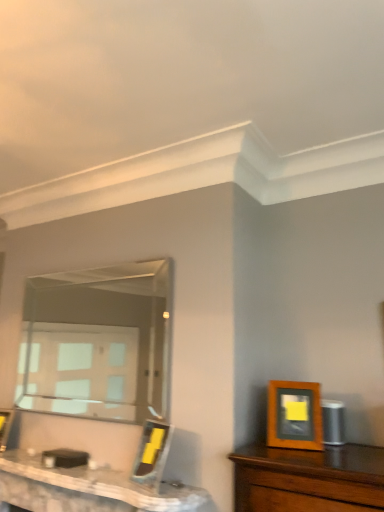
At what (x,y) coordinates should I click in order to perform the action: click on vacant point above clear glass mirror at center (from a real-world perspective). Please return your answer as a coordinate pair (x, y). Looking at the image, I should click on (113, 259).